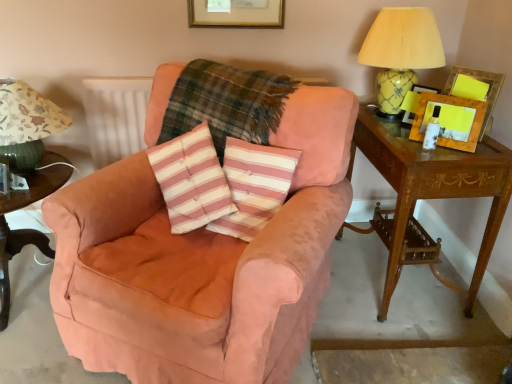
Question: Considering the positions of point (275, 168) and point (203, 59), is point (275, 168) closer or farther from the camera than point (203, 59)?

Choices:
 (A) farther
 (B) closer

Answer: (B)

Question: In terms of height, does pink striped cushion at center look taller or shorter compared to plaid fabric at center?

Choices:
 (A) tall
 (B) short

Answer: (B)

Question: Which of these objects is positioned farthest from the wooden picture frame at upper right, the 1th picture frame positioned from the right?

Choices:
 (A) mahogany wood side table at right
 (B) plaid fabric at center
 (C) pink striped cushion at center
 (D) white textured radiator at upper left
 (E) green fabric lampshade at left, the 1th table lamp from the left

Answer: (E)

Question: Which of these objects is positioned closest to the white textured radiator at upper left?

Choices:
 (A) dark green wood side table at lower left
 (B) yellow glossy lampshade at upper right, the first table lamp in the right-to-left sequence
 (C) pink striped cushion at center
 (D) wooden picture frame at upper right, the 1th picture frame positioned from the right
 (E) green fabric lampshade at left, the second table lamp from the right

Answer: (E)